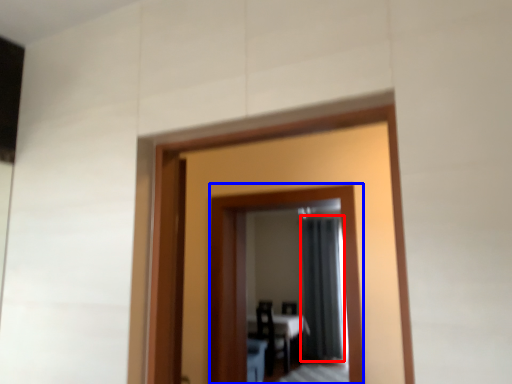
Question: Which of the following is the closest to the observer, curtain (highlighted by a red box) or mirror (highlighted by a blue box)?

Choices:
 (A) curtain
 (B) mirror

Answer: (B)